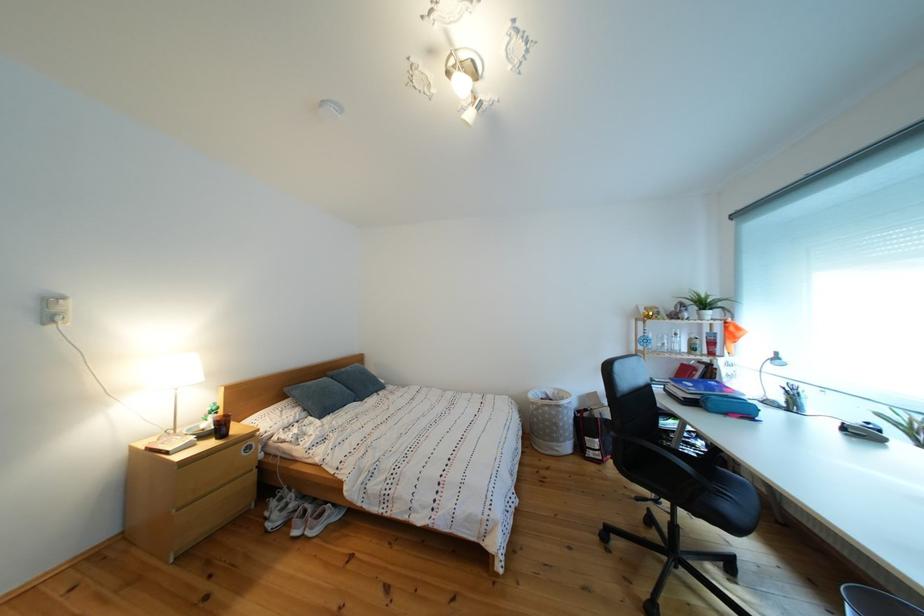
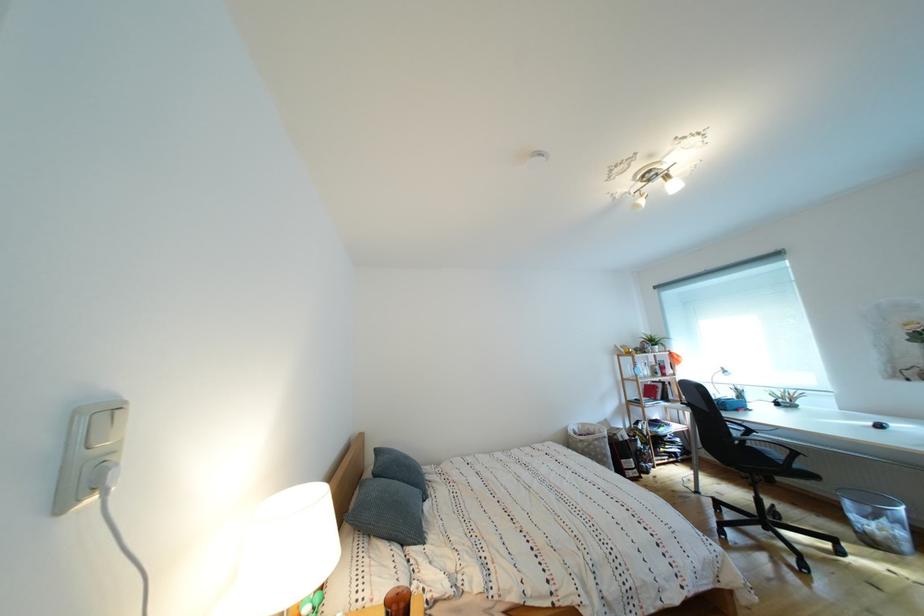
Locate, in the second image, the point that corresponds to (x=572, y=397) in the first image.

(594, 430)